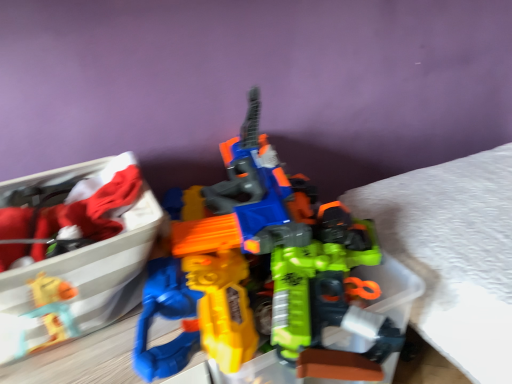
Question: Looking at their shapes, would you say matte plastic toy gun at center is wider or thinner than matte plastic toy gun at left?

Choices:
 (A) wide
 (B) thin

Answer: (A)

Question: Considering the positions of matte plastic toy gun at center and matte plastic toy gun at left in the image, is matte plastic toy gun at center bigger or smaller than matte plastic toy gun at left?

Choices:
 (A) big
 (B) small

Answer: (A)

Question: From the image's perspective, is matte plastic toy gun at center above or below matte plastic toy gun at left?

Choices:
 (A) below
 (B) above

Answer: (B)

Question: Considering the positions of matte plastic toy gun at left and matte plastic toy gun at center in the image, is matte plastic toy gun at left wider or thinner than matte plastic toy gun at center?

Choices:
 (A) thin
 (B) wide

Answer: (A)

Question: From the image's perspective, is matte plastic toy gun at left above or below matte plastic toy gun at center?

Choices:
 (A) above
 (B) below

Answer: (B)

Question: Based on their sizes in the image, would you say matte plastic toy gun at left is bigger or smaller than matte plastic toy gun at center?

Choices:
 (A) big
 (B) small

Answer: (B)

Question: From a real-world perspective, is matte plastic toy gun at left positioned above or below matte plastic toy gun at center?

Choices:
 (A) below
 (B) above

Answer: (A)